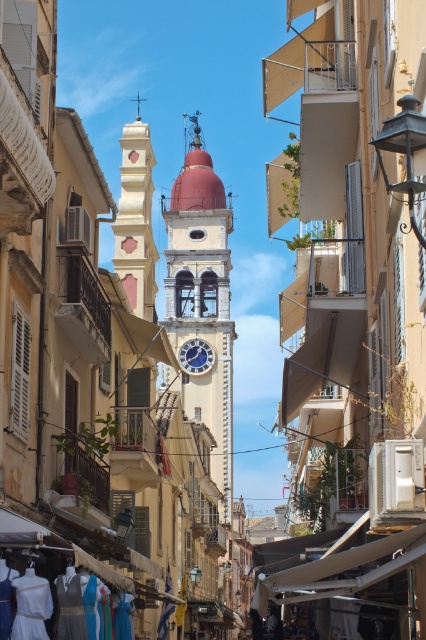
You are a tourist standing on the street and see the white cotton dresses at lower left and the blue glass clock at center. Which object is taller?

The white cotton dresses at lower left is much taller than the blue glass clock at center.

You are a tourist standing on the street looking at the smooth white church at center and the white stone clock tower at center. Which one is positioned to the right side of the other?

The smooth white church at center is to the right of the white stone clock tower at center.

You are a tourist standing on the street looking up at the buildings. Which structure is higher, the smooth white church at center or the white stone clock tower at center?

The smooth white church at center is positioned under the white stone clock tower at center, meaning the white stone clock tower at center is higher.